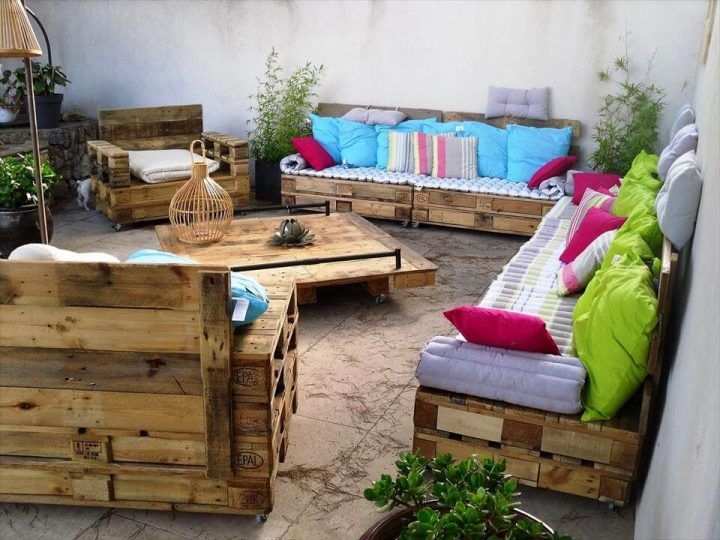
What are the coordinates of `teal cushions` in the screenshot? It's located at (333, 129), (366, 148), (389, 133), (435, 125), (481, 146), (538, 151), (250, 302).